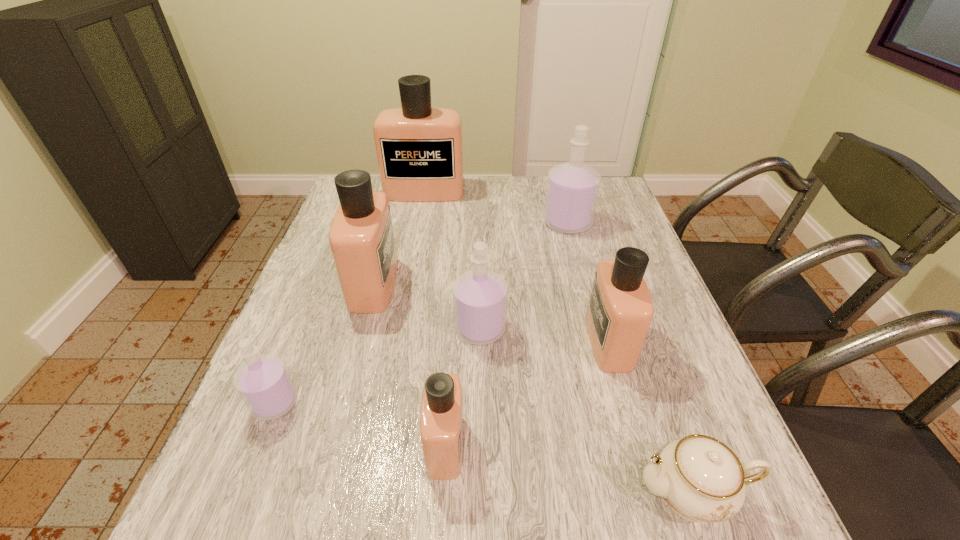
Identify the location of the nearest beige perfume. (441, 421).

The width and height of the screenshot is (960, 540). I want to click on the shortest object, so pyautogui.click(x=701, y=479).

Identify the location of free spot located 0.310m on the front label of the biggest beige perfume. (411, 264).

At what (x,y) coordinates should I click in order to perform the action: click on vacant space positioned on the front label of the second biggest beige perfume. Please return your answer as a coordinate pair (x, y). Image resolution: width=960 pixels, height=540 pixels. Looking at the image, I should click on (529, 284).

I want to click on free space located on the front of the farthest purple perfume, so click(x=578, y=264).

Find the location of a particular element. free space located 0.070m on the front label of the third biggest beige perfume is located at coordinates (558, 341).

Identify the location of vacant space situated on the front label of the third biggest beige perfume. (504, 341).

Locate an element on the screen. blank space located on the front label of the third biggest beige perfume is located at coordinates (445, 341).

This screenshot has height=540, width=960. Identify the location of free space located 0.290m on the left of the second purple perfume from right to left. (327, 328).

Find the location of a particular element. This screenshot has height=540, width=960. vacant space located 0.080m on the right of the nearest purple perfume is located at coordinates (338, 403).